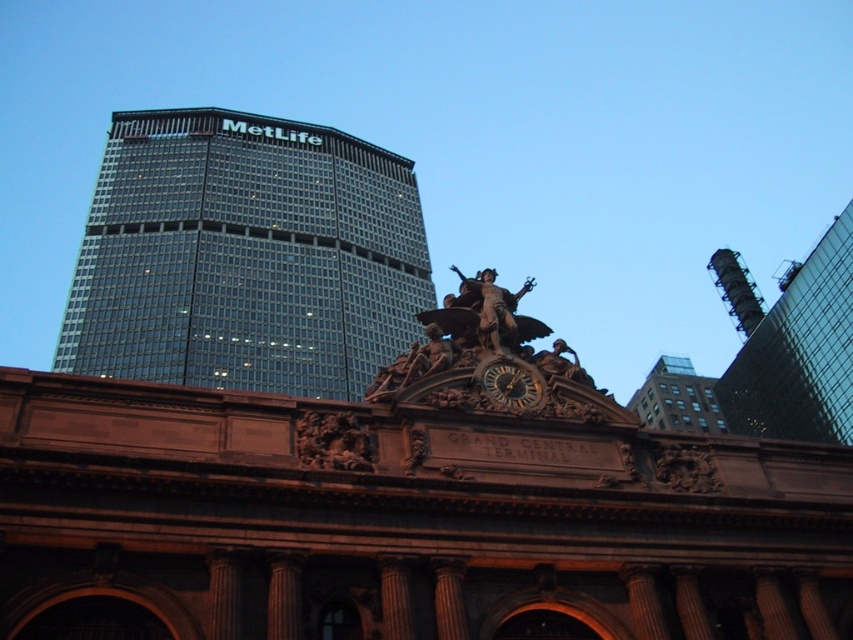
Question: Estimate the real-world distances between objects in this image. Which object is closer to the brown brick building at upper right?

Choices:
 (A) glassy steel skyscraper at upper left
 (B) dark gray metallic chimney at upper right
 (C) glassy steel bell tower at upper right

Answer: (B)

Question: Can you confirm if glassy steel bell tower at upper right is positioned to the left of wooden carved clock at center?

Choices:
 (A) no
 (B) yes

Answer: (A)

Question: Estimate the real-world distances between objects in this image. Which object is closer to the bronze statue at center?

Choices:
 (A) glassy steel skyscraper at upper left
 (B) brown brick building at upper right
 (C) glassy steel bell tower at upper right
 (D) wooden carved clock at center

Answer: (D)

Question: Which object is the farthest from the wooden carved clock at center?

Choices:
 (A) bronze statue at center
 (B) glassy steel bell tower at upper right
 (C) brown brick building at upper right

Answer: (C)

Question: Is brown brick building at upper right below bronze statue at center?

Choices:
 (A) yes
 (B) no

Answer: (A)

Question: Can you confirm if glassy steel bell tower at upper right is positioned above wooden carved clock at center?

Choices:
 (A) no
 (B) yes

Answer: (B)